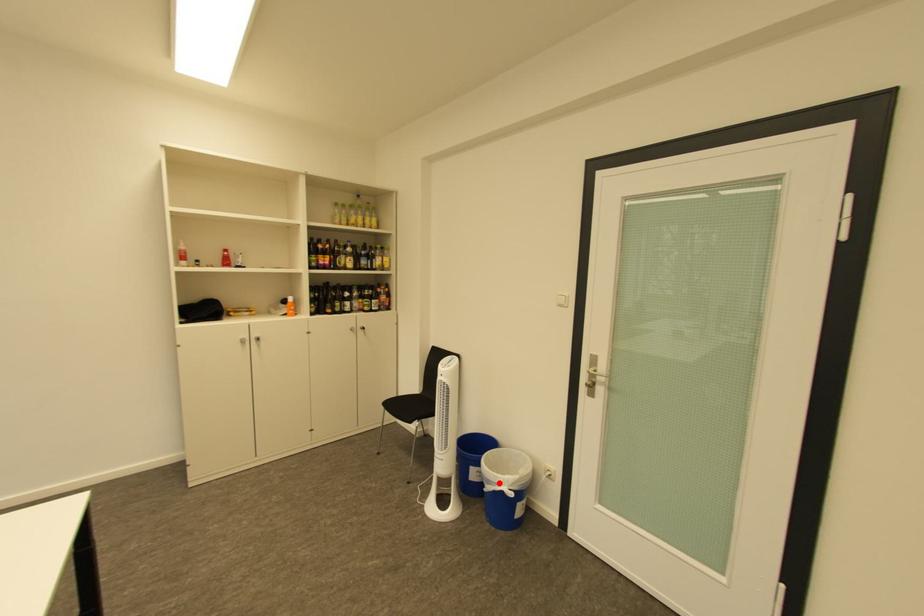
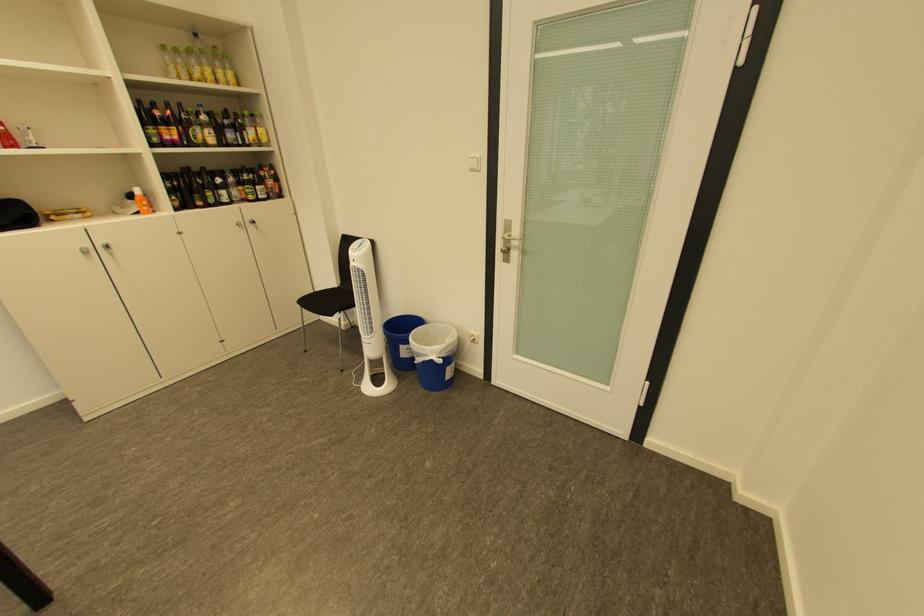
The point at the highlighted location is marked in the first image. Where is the corresponding point in the second image?

(429, 355)